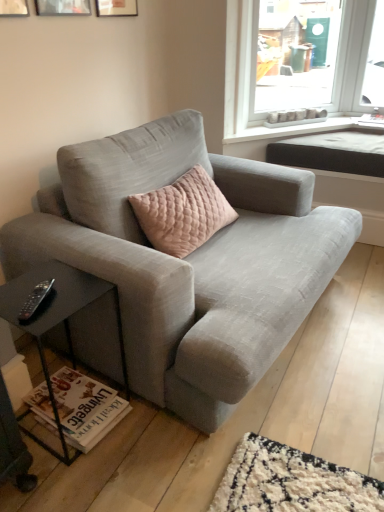
Locate an element on the screen. The height and width of the screenshot is (512, 384). free spot to the right of black plastic remote at lower left is located at coordinates (59, 305).